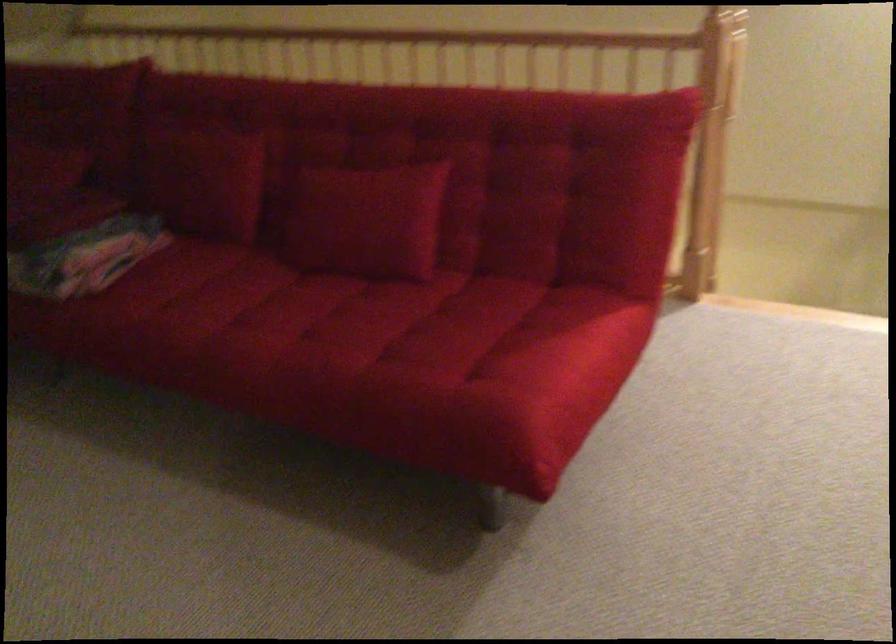
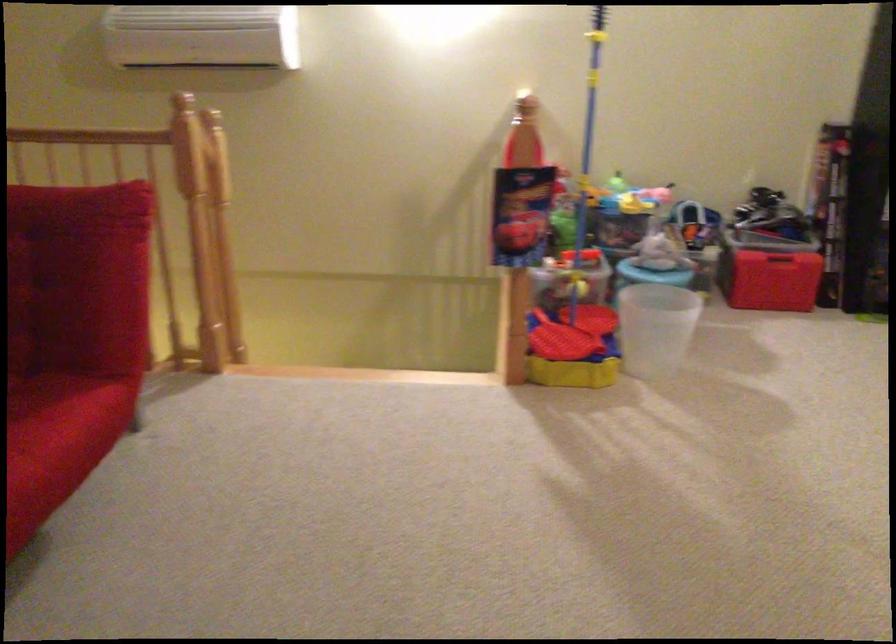
In a continuous first-person perspective shot, in which direction is the camera moving?

The cameraman walked toward right, backward.